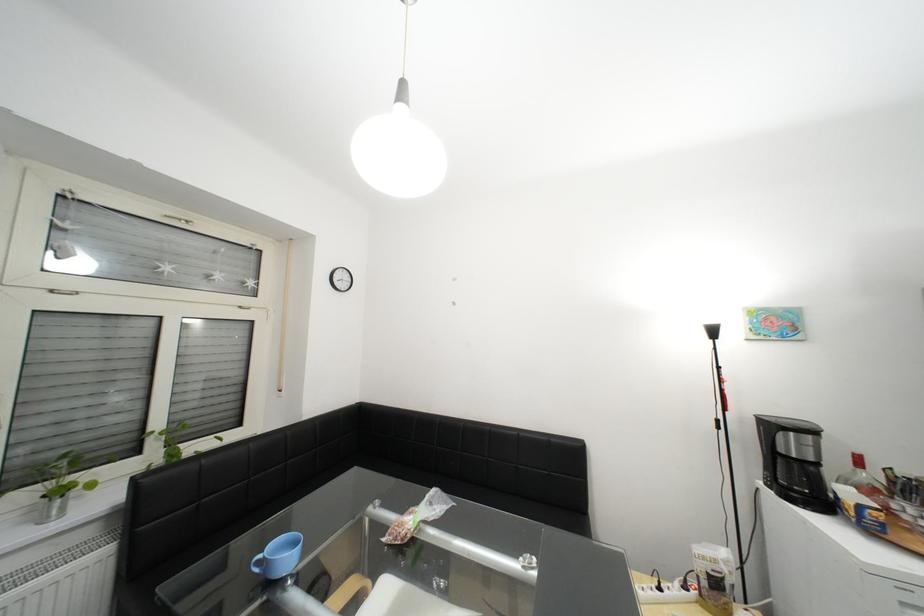
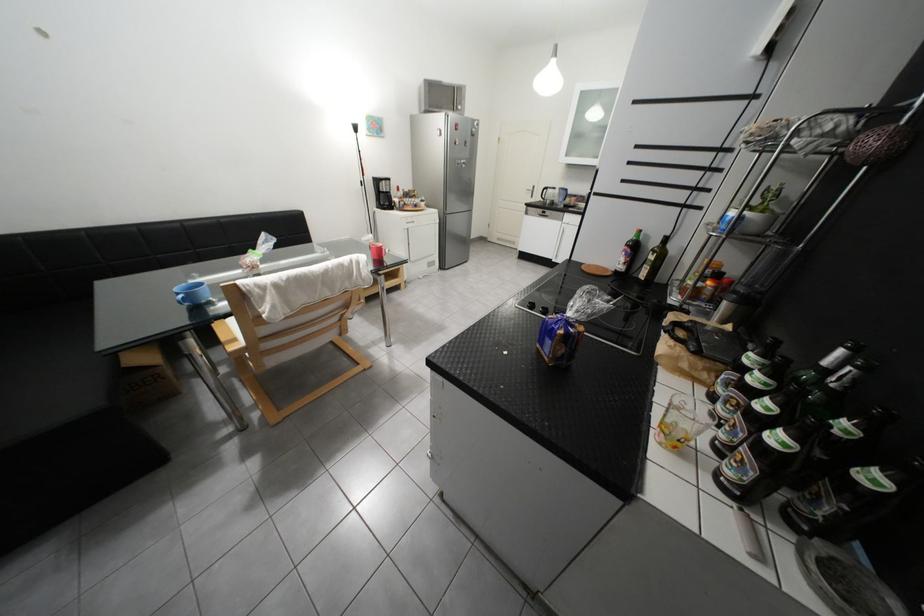
The point at (793, 462) is marked in the first image. Where is the corresponding point in the second image?

(393, 196)